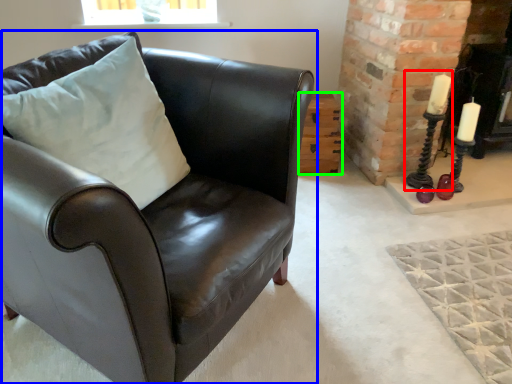
Question: Which object is the closest to the candle holder (highlighted by a red box)? Choose among these: chair (highlighted by a blue box) or table (highlighted by a green box).

Choices:
 (A) chair
 (B) table

Answer: (B)